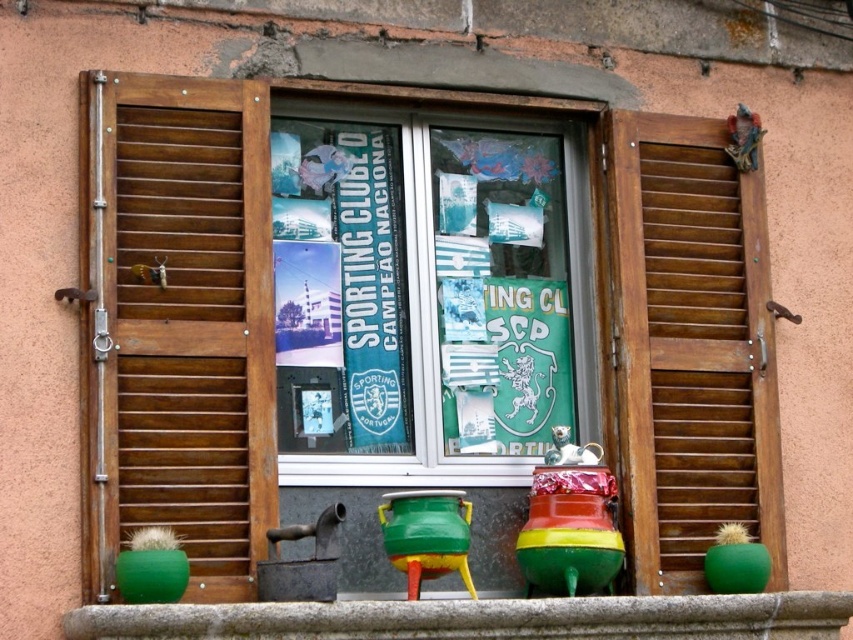
Is green glossy poster at center positioned behind wooden slats at left?

Yes, green glossy poster at center is further from the viewer.

Is green glossy poster at center wider than wooden slats at left?

Indeed, green glossy poster at center has a greater width compared to wooden slats at left.

Based on the photo, who is more distant from viewer, (415,406) or (254,456)?

Point (415,406)

Identify the location of green glossy poster at center. (428, 294).

Between point (233, 148) and point (767, 259), which one is positioned in front?

Point (233, 148) is more forward.

Is wooden slats at left positioned at the back of wooden at right?

No, wooden slats at left is closer to the viewer.

Where is `wooden slats at left`? Image resolution: width=853 pixels, height=640 pixels. wooden slats at left is located at coordinates (193, 326).

Does wooden slats at left appear on the left side of green ceramic pot at lower center?

Correct, you'll find wooden slats at left to the left of green ceramic pot at lower center.

In the scene shown: Who is shorter, wooden slats at left or green ceramic pot at lower center?

green ceramic pot at lower center

Is point (209, 342) behind point (755, 632)?

That is False.

Where is `wooden slats at left`? The height and width of the screenshot is (640, 853). wooden slats at left is located at coordinates (x=193, y=326).